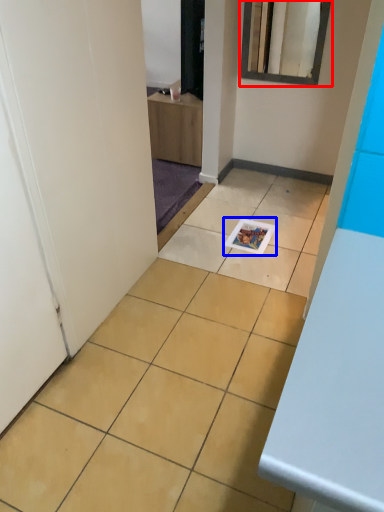
Question: Which object is further to the camera taking this photo, mirror (highlighted by a red box) or magazine (highlighted by a blue box)?

Choices:
 (A) mirror
 (B) magazine

Answer: (A)